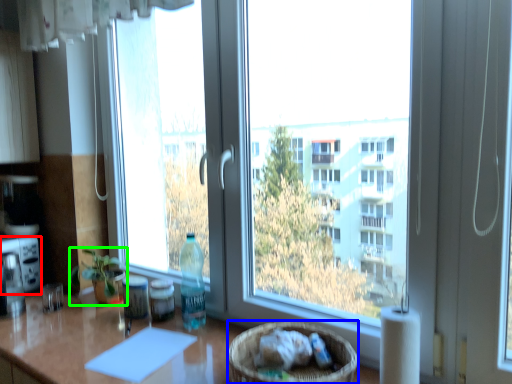
Question: Considering the real-world distances, which object is farthest from appliance (highlighted by a red box)? basket (highlighted by a blue box) or houseplant (highlighted by a green box)?

Choices:
 (A) basket
 (B) houseplant

Answer: (A)